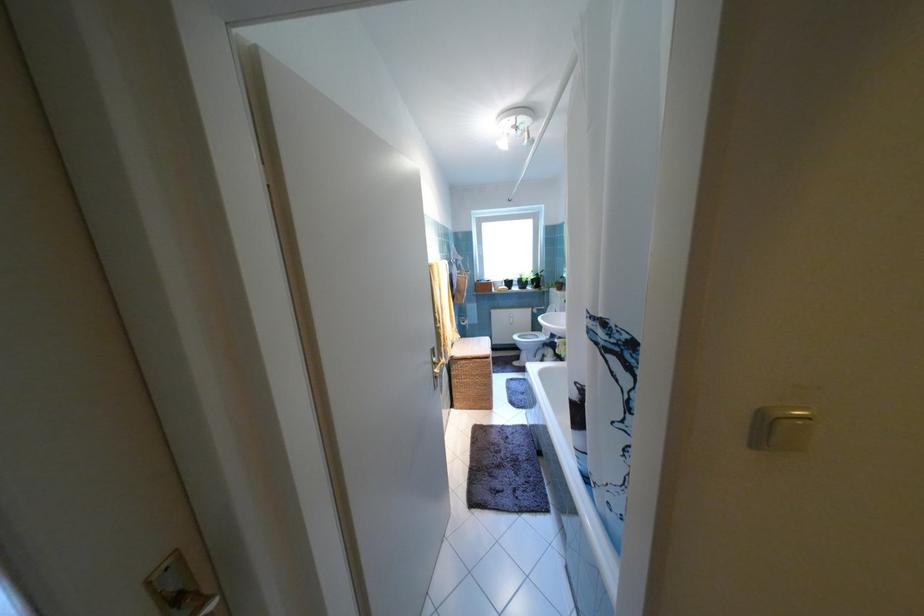
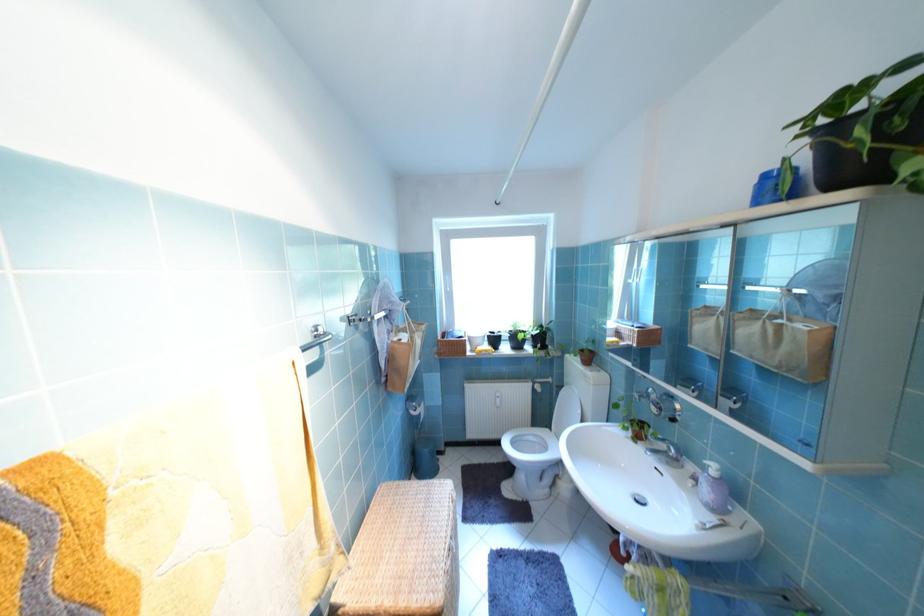
Find the pixel in the second image that matches point (525, 289) in the first image.

(515, 349)